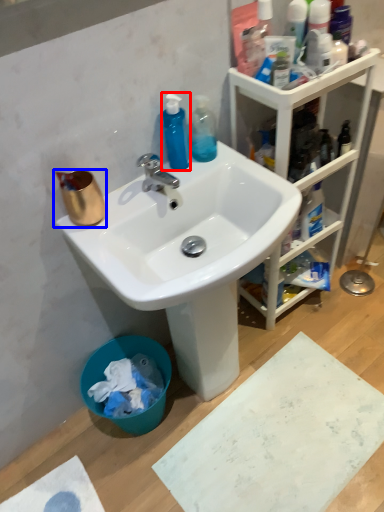
Question: Which object is closer to the camera taking this photo, cleaning product (highlighted by a red box) or coffee cup (highlighted by a blue box)?

Choices:
 (A) cleaning product
 (B) coffee cup

Answer: (B)